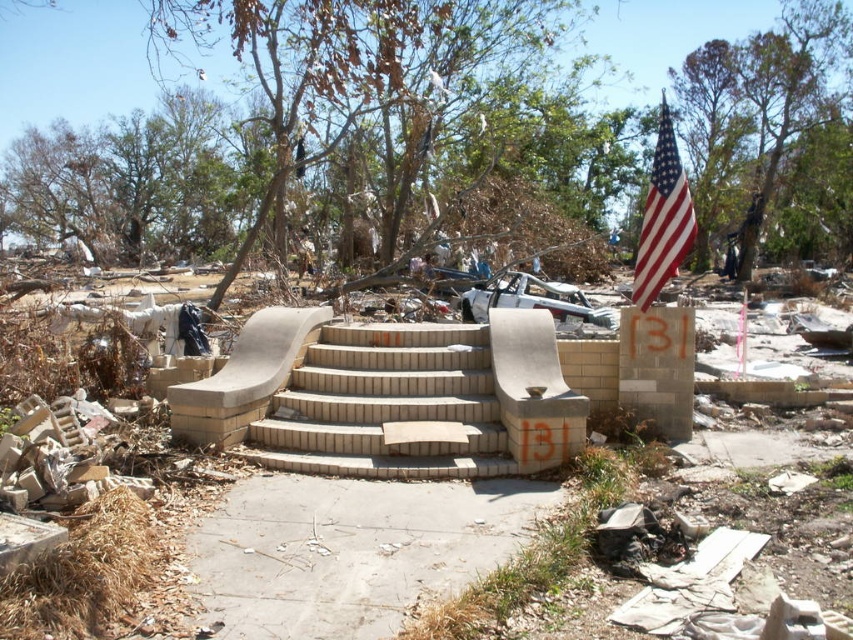
Question: Among these objects, which one is nearest to the camera?

Choices:
 (A) beige brick stairs at center
 (B) american flag at upper right

Answer: (A)

Question: Can you confirm if beige brick stairs at center is bigger than american flag at upper right?

Choices:
 (A) yes
 (B) no

Answer: (B)

Question: Does beige brick stairs at center lie in front of american flag at upper right?

Choices:
 (A) no
 (B) yes

Answer: (B)

Question: Which point appears farthest from the camera in this image?

Choices:
 (A) (276, 493)
 (B) (378, 332)

Answer: (B)

Question: Estimate the real-world distances between objects in this image. Which object is closer to the american flag at upper right?

Choices:
 (A) gray concrete sidewalk at center
 (B) beige brick stairs at center

Answer: (B)

Question: Does gray concrete sidewalk at center have a greater width compared to beige brick stairs at center?

Choices:
 (A) no
 (B) yes

Answer: (B)